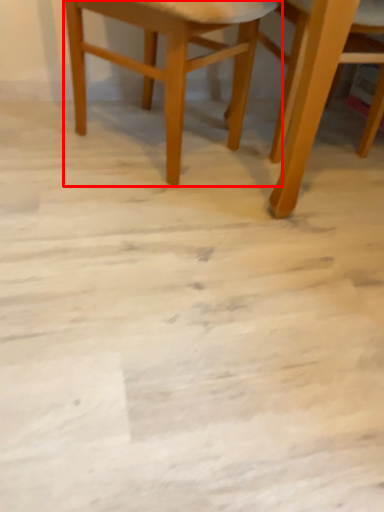
Question: Considering the relative positions of chair (annotated by the red box) and chair in the image provided, where is chair (annotated by the red box) located with respect to the staircase?

Choices:
 (A) left
 (B) right

Answer: (A)